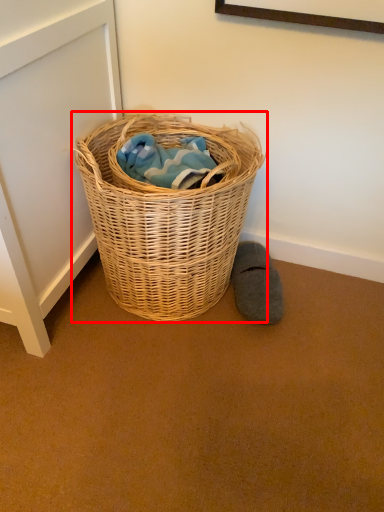
Question: Where is picnic basket (annotated by the red box) located in relation to footwear in the image?

Choices:
 (A) right
 (B) left

Answer: (B)